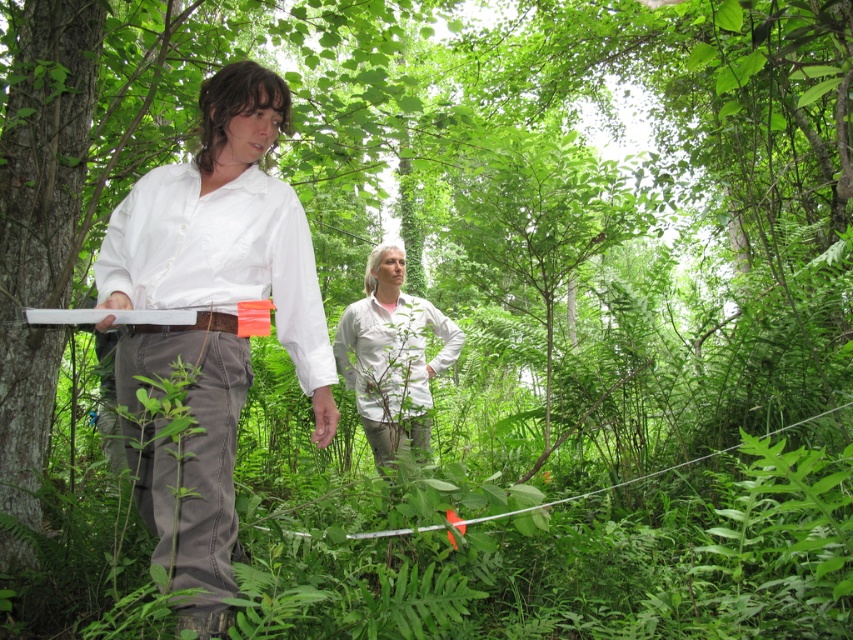
Is white cotton shirt at center bigger than white matte shirt at center?

Incorrect, white cotton shirt at center is not larger than white matte shirt at center.

Measure the distance between white cotton shirt at center and white matte shirt at center.

white cotton shirt at center and white matte shirt at center are 6.76 feet apart from each other.

Between point (218, 570) and point (409, 332), which one is positioned in front?

Point (218, 570) is in front.

Identify the location of white cotton shirt at center. This screenshot has height=640, width=853. (x=212, y=320).

Does point (186, 301) come behind point (384, 243)?

That is False.

Is point (294, 193) in front of point (387, 300)?

Yes, point (294, 193) is in front of point (387, 300).

Locate an element on the screen. Image resolution: width=853 pixels, height=640 pixels. white matte shirt at left is located at coordinates (219, 257).

Is white cotton shirt at center thinner than white matte shirt at left?

Yes, white cotton shirt at center is thinner than white matte shirt at left.

Can you confirm if white cotton shirt at center is positioned above white matte shirt at left?

No.

What do you see at coordinates (212, 320) in the screenshot? I see `white cotton shirt at center` at bounding box center [212, 320].

Find the location of a particular element. white cotton shirt at center is located at coordinates (212, 320).